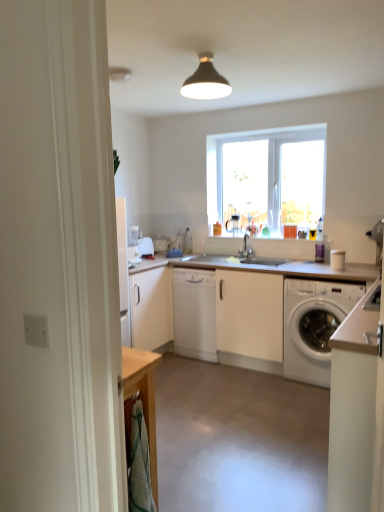
Question: From the image's perspective, is white glossy microwave at upper left positioned above or below white matte washing machine at lower right?

Choices:
 (A) below
 (B) above

Answer: (B)

Question: Considering the positions of point (147, 252) and point (286, 310), is point (147, 252) closer or farther from the camera than point (286, 310)?

Choices:
 (A) farther
 (B) closer

Answer: (A)

Question: Based on their relative distances, which object is nearer to the white matte washing machine at lower right?

Choices:
 (A) white matte cabinet at center, the first cabinetry from the back
 (B) white matte countertop at center
 (C) white glossy microwave at upper left
 (D) white matte cabinet at lower right, arranged as the 1th cabinetry when viewed from the right
 (E) transparent glass window at center

Answer: (B)

Question: Based on their relative distances, which object is nearer to the white matte countertop at center?

Choices:
 (A) white matte washing machine at lower right
 (B) white matte cabinet at lower right, which appears as the first cabinetry when viewed from the front
 (C) silver metallic faucet at center
 (D) matte black lampshade at upper center
 (E) transparent glass window at center

Answer: (A)